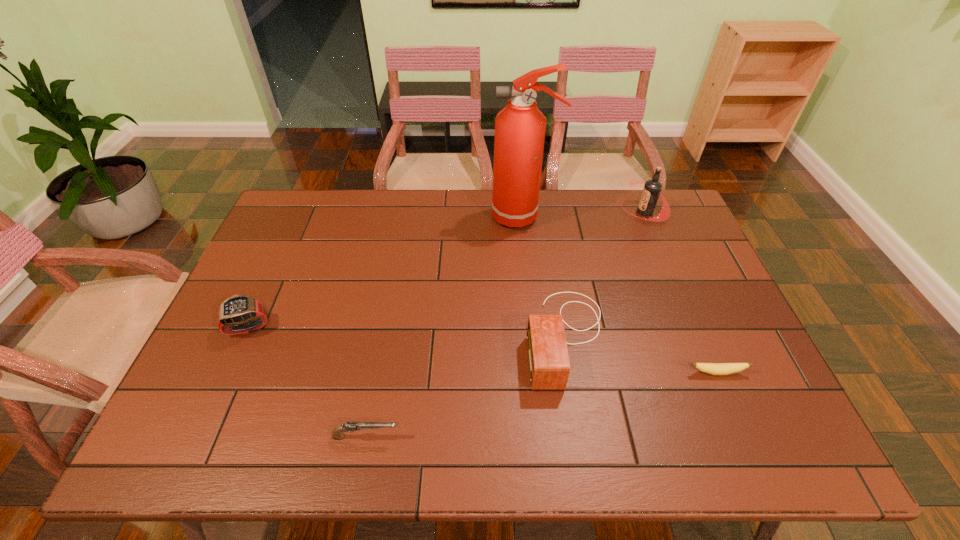
Identify the location of root beer at the far edge. (652, 189).

Where is `object located at the near edge`? object located at the near edge is located at coordinates (337, 434).

Where is `object at the left edge`? The height and width of the screenshot is (540, 960). object at the left edge is located at coordinates [239, 308].

Locate an element on the screen. This screenshot has width=960, height=540. root beer at the right edge is located at coordinates (652, 189).

What are the coordinates of `banana that is at the right edge` in the screenshot? It's located at (711, 368).

Where is `object that is at the far right corner`? This screenshot has width=960, height=540. object that is at the far right corner is located at coordinates (652, 189).

At what (x,y) coordinates should I click in order to perform the action: click on free space at the far edge of the desktop. Please return your answer as a coordinate pair (x, y). The image size is (960, 540). Looking at the image, I should click on (334, 224).

The width and height of the screenshot is (960, 540). What are the coordinates of `vacant space at the near edge of the desktop` in the screenshot? It's located at (281, 453).

Find the location of a particular element. vacant area at the left edge is located at coordinates (208, 403).

Image resolution: width=960 pixels, height=540 pixels. Identify the location of vacant region at the right edge of the desktop. (670, 279).